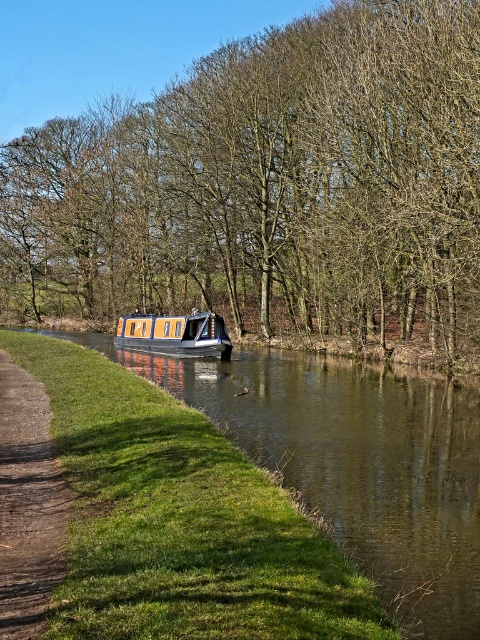
Is brown leafless trees at center smaller than brown dirt path at lower left?

Incorrect, brown leafless trees at center is not smaller in size than brown dirt path at lower left.

Is brown leafless trees at center taller than brown dirt path at lower left?

Correct, brown leafless trees at center is much taller as brown dirt path at lower left.

Where is `brown leafless trees at center`? This screenshot has width=480, height=640. brown leafless trees at center is located at coordinates (271, 186).

Identify the location of brown leafless trees at center. (271, 186).

Locate an element on the screen. This screenshot has height=640, width=480. smooth brown water at center is located at coordinates (355, 461).

Does smooth brown water at center have a lesser width compared to orange polished wood boat at center?

In fact, smooth brown water at center might be wider than orange polished wood boat at center.

Which is in front, point (382, 563) or point (157, 330)?

Positioned in front is point (382, 563).

You are a GUI agent. You are given a task and a screenshot of the screen. Output one action in this format:
    pyautogui.click(x=<x>, y=<y>)
    Task: Click on the smooth brown water at center
    
    Given the screenshot: What is the action you would take?
    pyautogui.click(x=355, y=461)

Between brown leafless trees at center and smooth brown water at center, which one appears on the left side from the viewer's perspective?

brown leafless trees at center

Does brown leafless trees at center appear on the right side of smooth brown water at center?

In fact, brown leafless trees at center is to the left of smooth brown water at center.

Is point (456, 246) behind point (425, 579)?

Yes.

This screenshot has width=480, height=640. In order to click on brown leafless trees at center in this screenshot , I will do `click(271, 186)`.